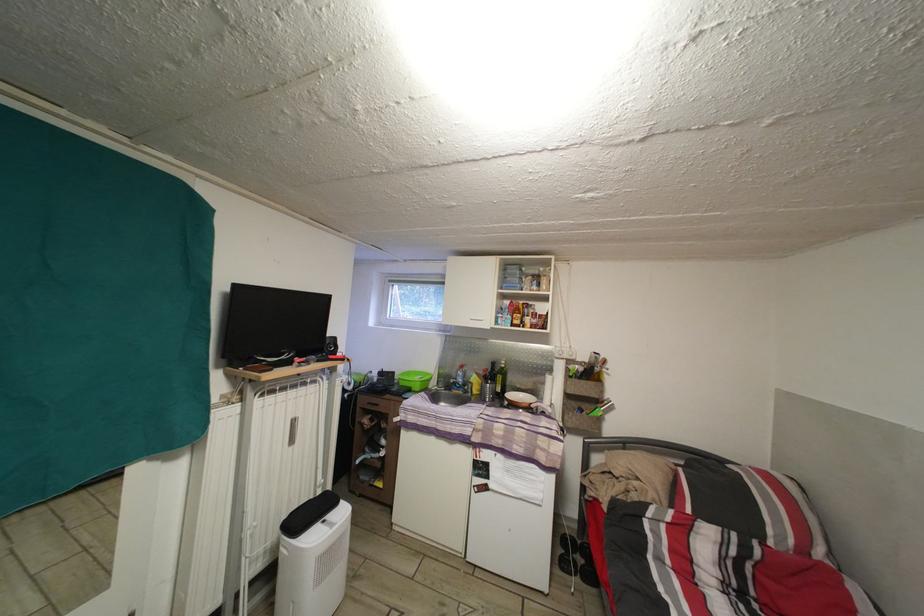
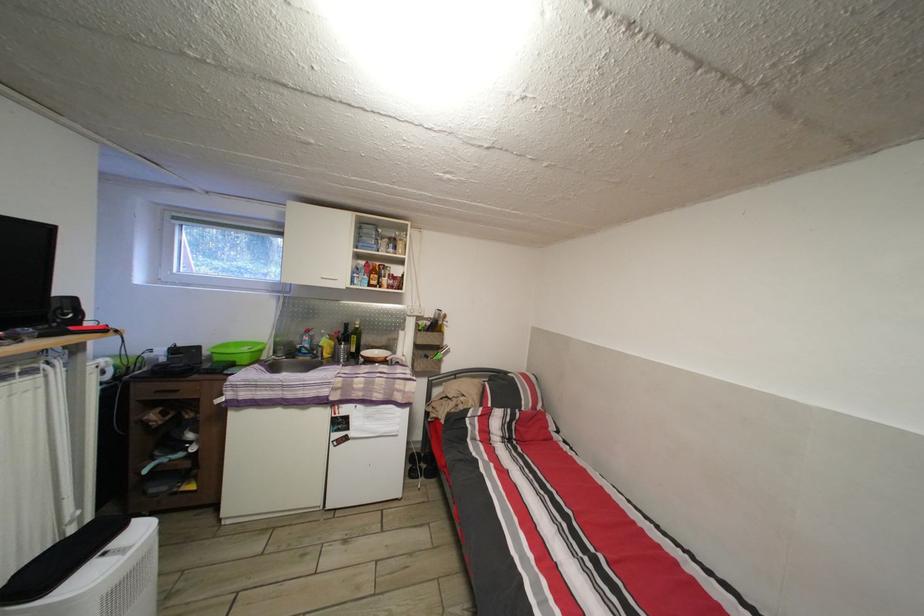
The point at (404, 384) is marked in the first image. Where is the corresponding point in the second image?

(213, 359)